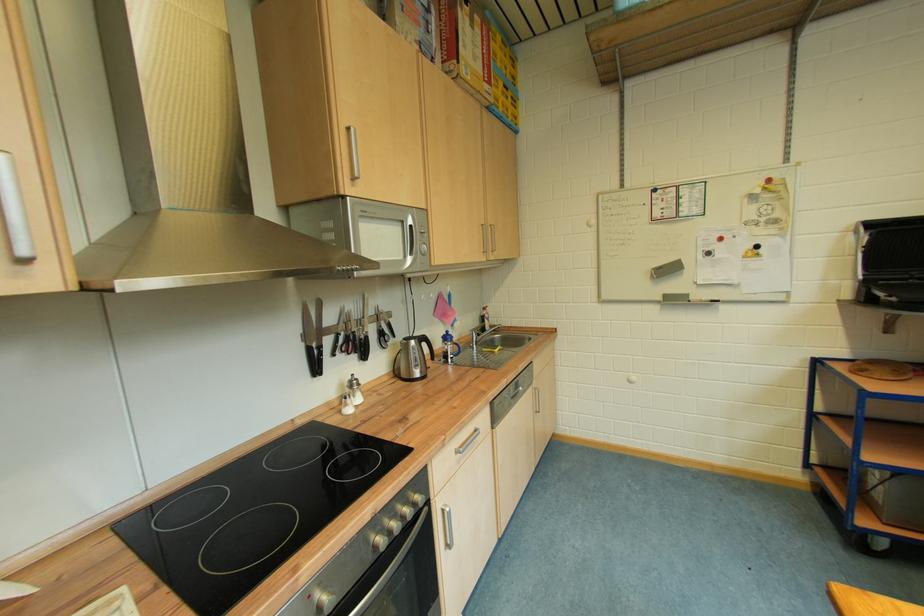
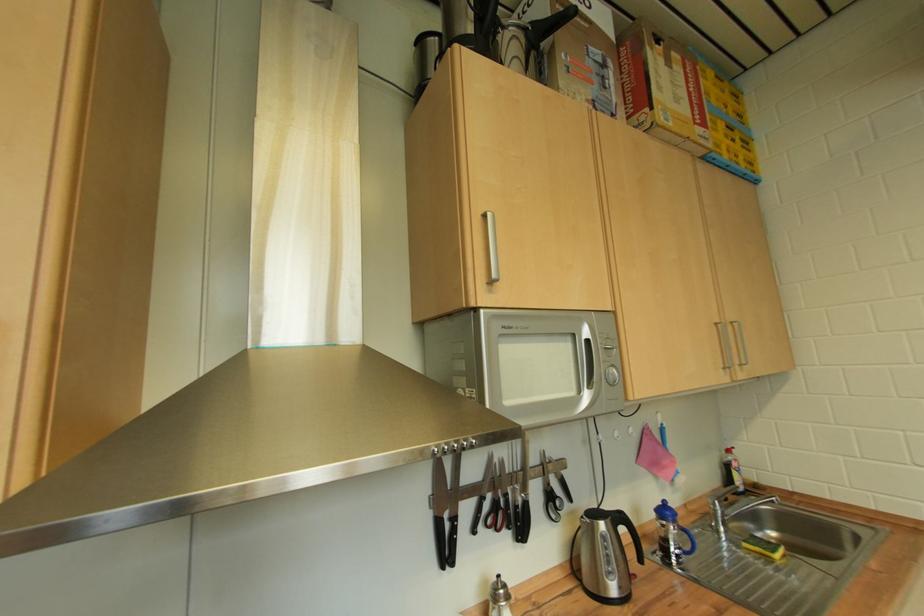
Question: How did the camera likely rotate?

Choices:
 (A) Left
 (B) Right
 (C) Up
 (D) Down

Answer: (A)